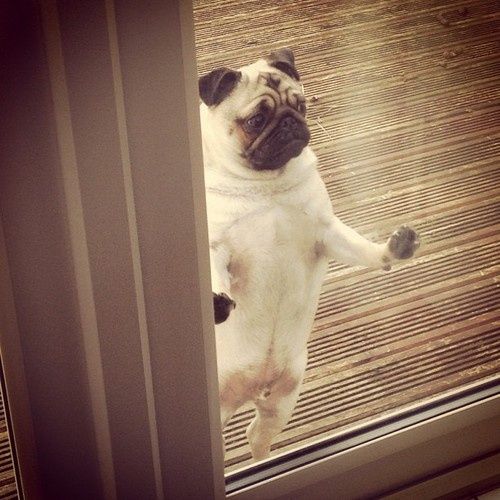
I want to click on sliding glass door, so click(x=246, y=33).